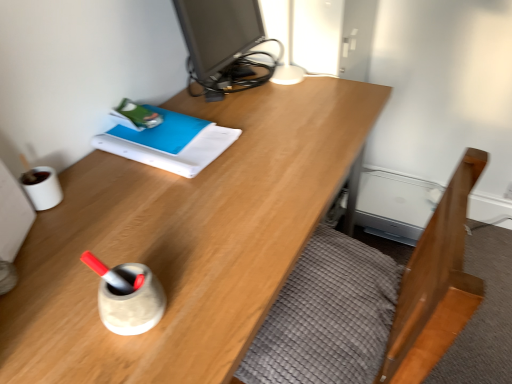
Question: Does blue matte book at upper left have a greater width compared to matte black monitor at upper center?

Choices:
 (A) yes
 (B) no

Answer: (A)

Question: Is blue matte book at upper left aimed at matte black monitor at upper center?

Choices:
 (A) no
 (B) yes

Answer: (A)

Question: Are blue matte book at upper left and matte black monitor at upper center making contact?

Choices:
 (A) yes
 (B) no

Answer: (B)

Question: From the image's perspective, is blue matte book at upper left on matte black monitor at upper center?

Choices:
 (A) yes
 (B) no

Answer: (B)

Question: Is blue matte book at upper left looking in the opposite direction of matte black monitor at upper center?

Choices:
 (A) no
 (B) yes

Answer: (A)

Question: Is wooden bed frame at lower right taller or shorter than blue matte book at upper left?

Choices:
 (A) tall
 (B) short

Answer: (A)

Question: In terms of width, does wooden bed frame at lower right look wider or thinner when compared to blue matte book at upper left?

Choices:
 (A) thin
 (B) wide

Answer: (A)

Question: Considering the positions of wooden bed frame at lower right and blue matte book at upper left in the image, is wooden bed frame at lower right bigger or smaller than blue matte book at upper left?

Choices:
 (A) small
 (B) big

Answer: (B)

Question: Visually, is wooden bed frame at lower right positioned to the left or to the right of blue matte book at upper left?

Choices:
 (A) right
 (B) left

Answer: (A)

Question: Considering their positions, is blue matte book at upper left located in front of or behind matte black monitor at upper center?

Choices:
 (A) front
 (B) behind

Answer: (A)

Question: In terms of height, does blue matte book at upper left look taller or shorter compared to matte black monitor at upper center?

Choices:
 (A) tall
 (B) short

Answer: (B)

Question: Considering the positions of point (156, 150) and point (249, 34), is point (156, 150) closer or farther from the camera than point (249, 34)?

Choices:
 (A) closer
 (B) farther

Answer: (A)

Question: Considering the positions of blue matte book at upper left and matte black monitor at upper center in the image, is blue matte book at upper left bigger or smaller than matte black monitor at upper center?

Choices:
 (A) small
 (B) big

Answer: (A)

Question: From the image's perspective, relative to wooden bed frame at lower right, is matte black monitor at upper center above or below?

Choices:
 (A) below
 (B) above

Answer: (B)

Question: From a real-world perspective, is matte black monitor at upper center physically located above or below wooden bed frame at lower right?

Choices:
 (A) below
 (B) above

Answer: (B)